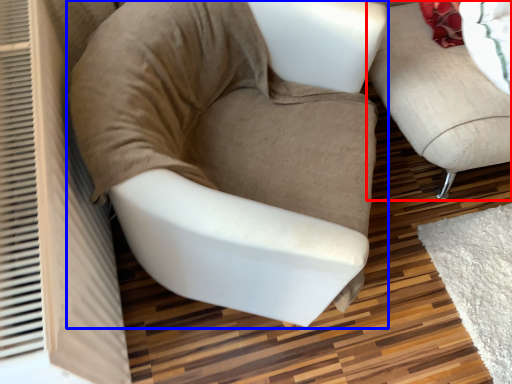
Question: Among these objects, which one is nearest to the camera, studio couch (highlighted by a red box) or chair (highlighted by a blue box)?

Choices:
 (A) studio couch
 (B) chair

Answer: (B)